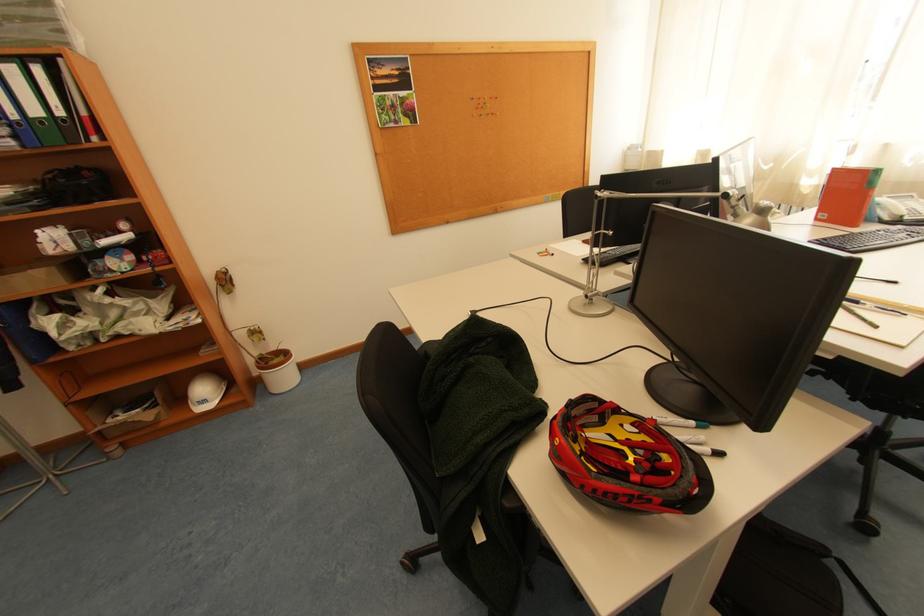
What do you see at coordinates (626, 459) in the screenshot? This screenshot has height=616, width=924. I see `the red bicycle helmet` at bounding box center [626, 459].